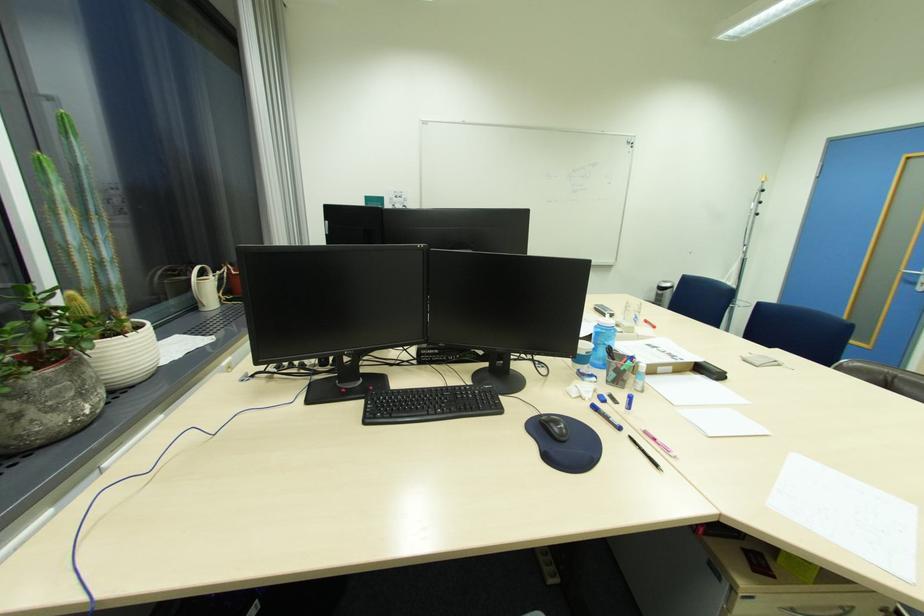
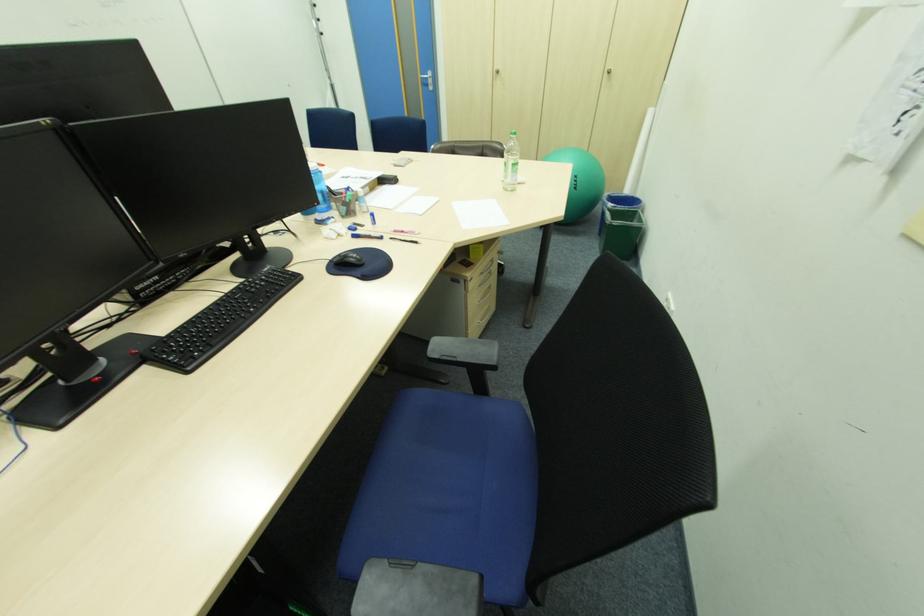
First-person continuous shooting, in which direction is the camera rotating?

The rotation direction of the camera is right-down.